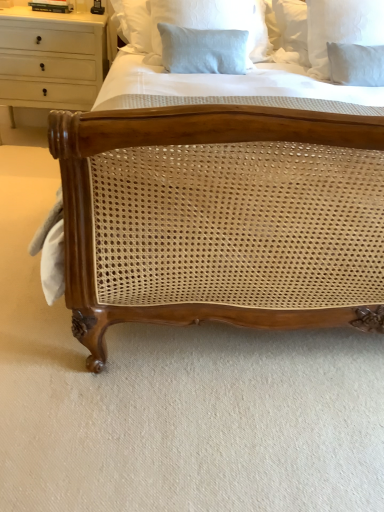
This screenshot has width=384, height=512. What do you see at coordinates (51, 59) in the screenshot?
I see `white wood chest of drawers at upper left` at bounding box center [51, 59].

The image size is (384, 512). I want to click on white linen pillow at upper right, which is counted as the 1th pillow, starting from the right, so click(341, 28).

Where is `light blue linen pillow at upper center, the 1th pillow from the left`? The height and width of the screenshot is (512, 384). light blue linen pillow at upper center, the 1th pillow from the left is located at coordinates (212, 23).

Looking at the image, does white wood chest of drawers at upper left seem bigger or smaller compared to white linen pillow at upper right, arranged as the 2th pillow when viewed from the left?

In the image, white wood chest of drawers at upper left appears to be larger than white linen pillow at upper right, arranged as the 2th pillow when viewed from the left.

From the image's perspective, starting from the white wood chest of drawers at upper left, which pillow is the 2nd one below? Please provide its 2D coordinates.

[(341, 28)]

Considering the relative sizes of white wood chest of drawers at upper left and white linen pillow at upper right, arranged as the 2th pillow when viewed from the left, in the image provided, is white wood chest of drawers at upper left shorter than white linen pillow at upper right, arranged as the 2th pillow when viewed from the left,?

No.

What's the angular difference between white wood chest of drawers at upper left and white linen pillow at upper right, arranged as the 2th pillow when viewed from the left,'s facing directions?

There is a 4.71-degree angle between the facing directions of white wood chest of drawers at upper left and white linen pillow at upper right, arranged as the 2th pillow when viewed from the left.

Is light blue linen pillow at upper center, arranged as the 2th pillow when viewed from the right, inside white wood chest of drawers at upper left?

That's incorrect, light blue linen pillow at upper center, arranged as the 2th pillow when viewed from the right, is not inside white wood chest of drawers at upper left.

Can you tell me how much white wood chest of drawers at upper left and light blue linen pillow at upper center, arranged as the 2th pillow when viewed from the right, differ in facing direction?

The angle between the facing direction of white wood chest of drawers at upper left and the facing direction of light blue linen pillow at upper center, arranged as the 2th pillow when viewed from the right, is 0.923 degrees.

In terms of size, does white wood chest of drawers at upper left appear bigger or smaller than light blue linen pillow at upper center, the 1th pillow from the left?

white wood chest of drawers at upper left is bigger than light blue linen pillow at upper center, the 1th pillow from the left.

Can you confirm if white wood chest of drawers at upper left is positioned to the left of light blue linen pillow at upper center, the 1th pillow from the left?

Yes, white wood chest of drawers at upper left is to the left of light blue linen pillow at upper center, the 1th pillow from the left.

Can we say light blue linen pillow at upper center, the 1th pillow from the left, lies outside white linen pillow at upper right, arranged as the 2th pillow when viewed from the left?

Yes, light blue linen pillow at upper center, the 1th pillow from the left, is located beyond the bounds of white linen pillow at upper right, arranged as the 2th pillow when viewed from the left.

Can you confirm if light blue linen pillow at upper center, the 1th pillow from the left, is positioned to the left of white linen pillow at upper right, which is counted as the 1th pillow, starting from the right?

Yes.

How many degrees apart are the facing directions of light blue linen pillow at upper center, the 1th pillow from the left, and white linen pillow at upper right, arranged as the 2th pillow when viewed from the left?

The angular difference between light blue linen pillow at upper center, the 1th pillow from the left, and white linen pillow at upper right, arranged as the 2th pillow when viewed from the left, is 3.78 degrees.

Is point (358, 39) farther from viewer compared to point (266, 42)?

No, (358, 39) is closer to viewer.

From a real-world perspective, is white linen pillow at upper right, which is counted as the 1th pillow, starting from the right, located beneath light blue linen pillow at upper center, arranged as the 2th pillow when viewed from the right?

Yes, from a real-world perspective, white linen pillow at upper right, which is counted as the 1th pillow, starting from the right, is beneath light blue linen pillow at upper center, arranged as the 2th pillow when viewed from the right.

Can you see white linen pillow at upper right, which is counted as the 1th pillow, starting from the right, touching light blue linen pillow at upper center, arranged as the 2th pillow when viewed from the right?

There is a gap between white linen pillow at upper right, which is counted as the 1th pillow, starting from the right, and light blue linen pillow at upper center, arranged as the 2th pillow when viewed from the right.

Is white linen pillow at upper right, which is counted as the 1th pillow, starting from the right, taller or shorter than light blue linen pillow at upper center, the 1th pillow from the left?

Clearly, white linen pillow at upper right, which is counted as the 1th pillow, starting from the right, is taller compared to light blue linen pillow at upper center, the 1th pillow from the left.

Which is behind, white linen pillow at upper right, which is counted as the 1th pillow, starting from the right, or white wood chest of drawers at upper left?

white wood chest of drawers at upper left is more distant.

From the white wood chest of drawers at upper left, count 1st pillows forward and point to it. Please provide its 2D coordinates.

[(341, 28)]

Is point (346, 1) closer or farther from the camera than point (73, 81)?

Point (346, 1) appears to be closer to the viewer than point (73, 81).

Is light blue linen pillow at upper center, the 1th pillow from the left, directly adjacent to white wood chest of drawers at upper left?

No, light blue linen pillow at upper center, the 1th pillow from the left, is not in contact with white wood chest of drawers at upper left.

Choose the correct answer: Is light blue linen pillow at upper center, arranged as the 2th pillow when viewed from the right, inside white wood chest of drawers at upper left or outside it?

light blue linen pillow at upper center, arranged as the 2th pillow when viewed from the right, is outside white wood chest of drawers at upper left.

Is light blue linen pillow at upper center, the 1th pillow from the left, bigger than white wood chest of drawers at upper left?

No, light blue linen pillow at upper center, the 1th pillow from the left, is not bigger than white wood chest of drawers at upper left.

Which point is more distant from viewer, (259, 19) or (60, 34)?

Point (60, 34)

Where is `the 1st pillow in front of the white wood chest of drawers at upper left, starting your count from the anchor`? The height and width of the screenshot is (512, 384). the 1st pillow in front of the white wood chest of drawers at upper left, starting your count from the anchor is located at coordinates (341, 28).

The image size is (384, 512). I want to click on the 1st pillow below the white wood chest of drawers at upper left (from the image's perspective), so click(212, 23).

Based on their spatial positions, is white wood chest of drawers at upper left or white linen pillow at upper right, which is counted as the 1th pillow, starting from the right, closer to light blue linen pillow at upper center, the 1th pillow from the left?

Based on the image, white linen pillow at upper right, which is counted as the 1th pillow, starting from the right, appears to be nearer to light blue linen pillow at upper center, the 1th pillow from the left.

Based on their spatial positions, is light blue linen pillow at upper center, arranged as the 2th pillow when viewed from the right, or white linen pillow at upper right, which is counted as the 1th pillow, starting from the right, closer to white wood chest of drawers at upper left?

Among the two, light blue linen pillow at upper center, arranged as the 2th pillow when viewed from the right, is located nearer to white wood chest of drawers at upper left.

Which object lies further to the anchor point white linen pillow at upper right, which is counted as the 1th pillow, starting from the right, white wood chest of drawers at upper left or light blue linen pillow at upper center, the 1th pillow from the left?

white wood chest of drawers at upper left is positioned further to the anchor white linen pillow at upper right, which is counted as the 1th pillow, starting from the right.

Estimate the real-world distances between objects in this image. Which object is further from white wood chest of drawers at upper left, white linen pillow at upper right, which is counted as the 1th pillow, starting from the right, or light blue linen pillow at upper center, arranged as the 2th pillow when viewed from the right?

Among the two, white linen pillow at upper right, which is counted as the 1th pillow, starting from the right, is located further to white wood chest of drawers at upper left.

Which object lies nearer to the anchor point white linen pillow at upper right, which is counted as the 1th pillow, starting from the right, light blue linen pillow at upper center, the 1th pillow from the left, or white wood chest of drawers at upper left?

light blue linen pillow at upper center, the 1th pillow from the left, is positioned closer to the anchor white linen pillow at upper right, which is counted as the 1th pillow, starting from the right.

Based on their spatial positions, is white linen pillow at upper right, which is counted as the 1th pillow, starting from the right, or white wood chest of drawers at upper left closer to light blue linen pillow at upper center, arranged as the 2th pillow when viewed from the right?

white linen pillow at upper right, which is counted as the 1th pillow, starting from the right, lies closer to light blue linen pillow at upper center, arranged as the 2th pillow when viewed from the right, than the other object.

I want to click on pillow between white wood chest of drawers at upper left and white linen pillow at upper right, arranged as the 2th pillow when viewed from the left, so click(x=212, y=23).